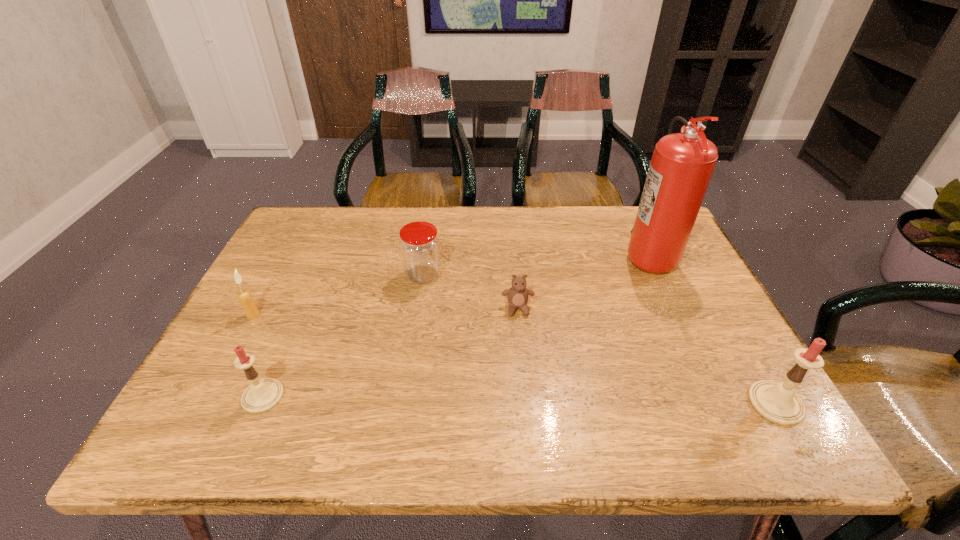
At what (x,y) coordinates should I click in order to perform the action: click on the second candle from right to left. Please return your answer as a coordinate pair (x, y). Looking at the image, I should click on (262, 395).

I want to click on the second tallest object, so pyautogui.click(x=777, y=402).

Identify the location of the tallest candle. Image resolution: width=960 pixels, height=540 pixels. (777, 402).

What are the coordinates of `the third object from left to right` in the screenshot? It's located at (419, 245).

The image size is (960, 540). I want to click on the fourth object from left to right, so click(518, 294).

I want to click on teddy bear, so click(x=518, y=294).

What are the coordinates of `the farthest candle` in the screenshot? It's located at (244, 296).

Identify the location of the leftmost candle. The image size is (960, 540). (244, 296).

The width and height of the screenshot is (960, 540). Identify the location of fire extinguisher. (682, 164).

The image size is (960, 540). Identify the location of free space located on the right of the second object from left to right. (467, 396).